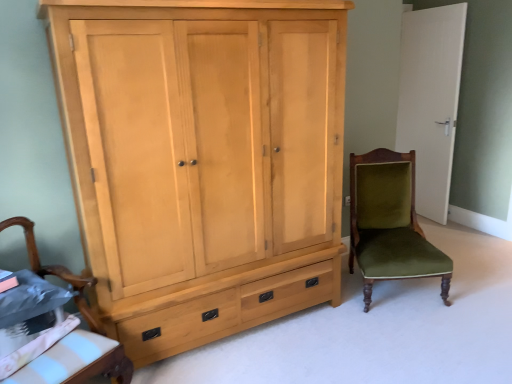
Question: From the image's perspective, relative to velvet green chair at right, the 1th chair positioned from the back, is light wood wardrobe at left above or below?

Choices:
 (A) above
 (B) below

Answer: (A)

Question: Is light wood wardrobe at left wider or thinner than velvet green chair at right, the first chair when ordered from right to left?

Choices:
 (A) wide
 (B) thin

Answer: (B)

Question: Which object is positioned closest to the velvet green chair at right, placed as the second chair when sorted from left to right?

Choices:
 (A) wooden armchair at lower left, placed as the 2th chair when sorted from back to front
 (B) white matte door at upper right
 (C) light wood wardrobe at left

Answer: (C)

Question: Which is nearer to the wooden armchair at lower left, which is the first chair in left-to-right order?

Choices:
 (A) white matte door at upper right
 (B) velvet green chair at right, the 1th chair positioned from the back
 (C) light wood wardrobe at left

Answer: (C)